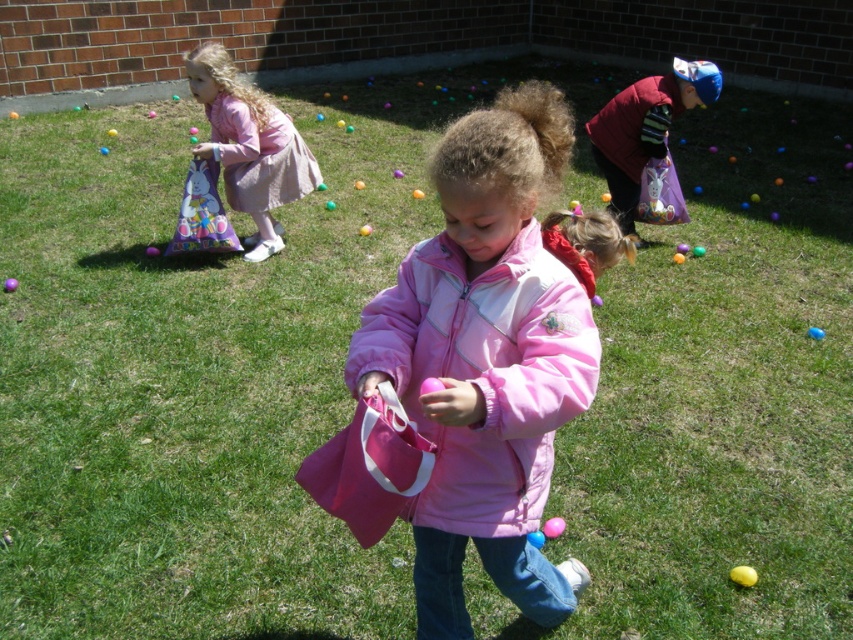
You are a child participating in an Easter egg hunt and you see the pink fabric bag at upper left and the purple matte egg at center. Which object is closer to you?

The pink fabric bag at upper left is closer to you because it is further to the viewer than the purple matte egg at center.

You are a parent supervising the Easter egg hunt. You notice a pink fabric bag at upper left. Where exactly is the pink fabric bag located in relation to the point marked at coordinates (248, 145)?

The pink fabric bag at upper left is located exactly at the point marked at coordinates (248, 145).